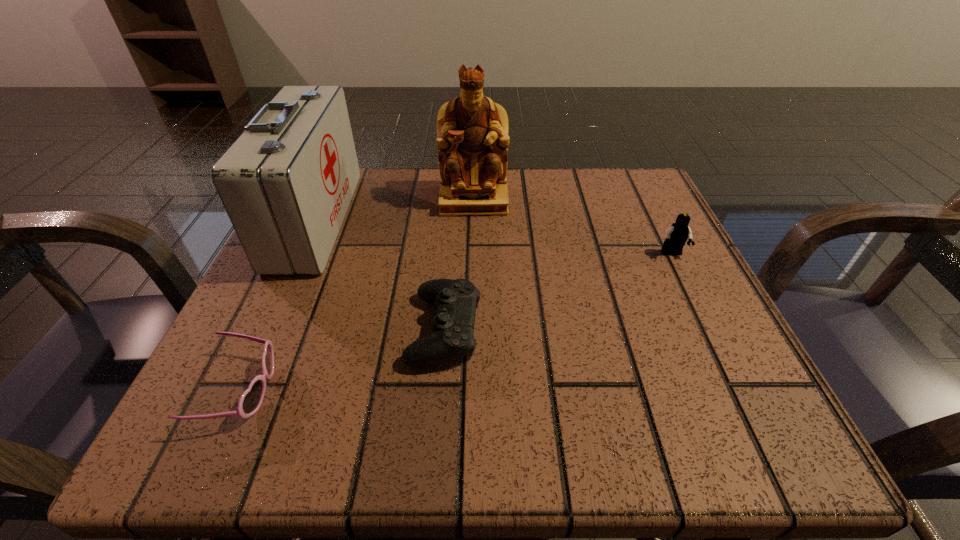
Find the location of a particular element. The width and height of the screenshot is (960, 540). vacant area between the second shortest object and the figurine is located at coordinates (459, 265).

Identify the location of free point between the first-aid kit and the third shortest object. coord(494,237).

The image size is (960, 540). Find the location of `empty location between the tallest object and the fourth shortest object`. empty location between the tallest object and the fourth shortest object is located at coordinates (395, 210).

You are a GUI agent. You are given a task and a screenshot of the screen. Output one action in this format:
    pyautogui.click(x=<x>, y=<y>)
    Task: Click on the vacant space in between the tallest object and the first-aid kit
    This screenshot has height=540, width=960.
    Given the screenshot: What is the action you would take?
    pyautogui.click(x=395, y=210)

Find the location of a particular element. object that is the fourth closest to the sunglasses is located at coordinates (676, 236).

Identify the location of the fourth closest object to the figurine. Image resolution: width=960 pixels, height=540 pixels. (251, 400).

Find the location of a particular element. The width and height of the screenshot is (960, 540). vacant area that satisfies the following two spatial constraints: 1. on the front-facing side of the figurine; 2. on the front-facing side of the sunglasses is located at coordinates (470, 390).

Locate an element on the screen. This screenshot has height=540, width=960. vacant space that satisfies the following two spatial constraints: 1. on the front-facing side of the rightmost object; 2. on the front-facing side of the shortest object is located at coordinates (739, 390).

The image size is (960, 540). I want to click on vacant space that satisfies the following two spatial constraints: 1. on the front side of the control; 2. on the front-facing side of the shortest object, so click(x=440, y=390).

Find the location of a particular element. The width and height of the screenshot is (960, 540). vacant area that satisfies the following two spatial constraints: 1. on the front-facing side of the second tallest object; 2. on the back side of the fourth tallest object is located at coordinates (266, 329).